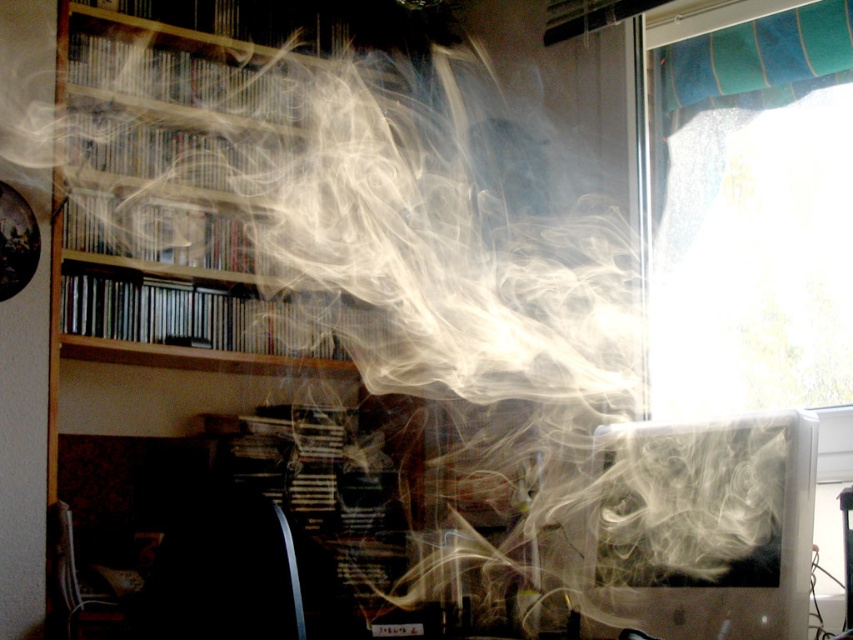
Who is more forward, (689, 74) or (712, 593)?

Point (712, 593) is in front.

Does transparent glass window at upper right come behind white glossy computer monitor at lower right?

That is True.

Which is behind, point (793, 100) or point (798, 490)?

Positioned behind is point (793, 100).

Find the location of a particular element. transparent glass window at upper right is located at coordinates (752, 216).